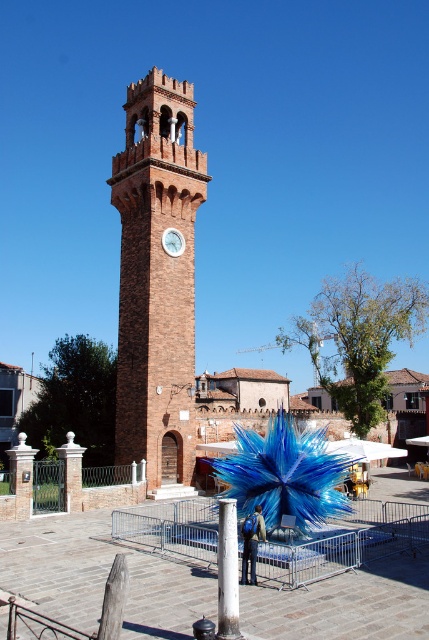
Who is more forward, (142, 429) or (183, 236)?

Point (142, 429) is more forward.

Does brick clock tower at center have a greater width compared to white glossy clock at center?

Yes, brick clock tower at center is wider than white glossy clock at center.

Locate an element on the screen. The image size is (429, 640). brick clock tower at center is located at coordinates (157, 280).

Can you confirm if white painted metal pole at center is wider than white glossy clock at center?

Incorrect, white painted metal pole at center's width does not surpass white glossy clock at center's.

Is point (229, 547) closer to camera compared to point (181, 240)?

Yes, point (229, 547) is closer to viewer.

Locate an element on the screen. The width and height of the screenshot is (429, 640). white painted metal pole at center is located at coordinates (227, 572).

Who is more distant from viewer, (178, 268) or (232, 602)?

Positioned behind is point (178, 268).

Does brick clock tower at center appear under white painted metal pole at center?

Actually, brick clock tower at center is above white painted metal pole at center.

Is point (138, 136) positioned in front of point (227, 516)?

No, it is behind (227, 516).

Locate an element on the screen. The height and width of the screenshot is (640, 429). brick clock tower at center is located at coordinates (157, 280).